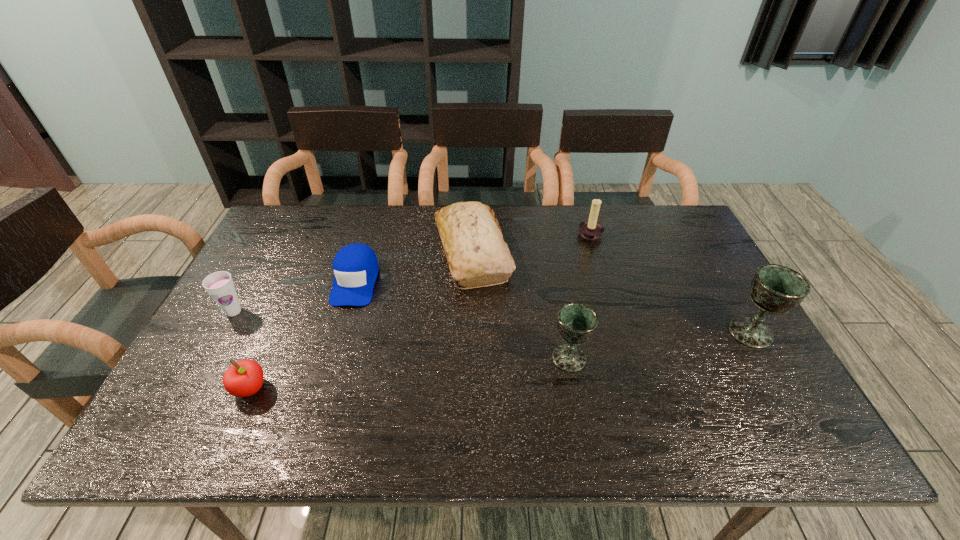
Observe the arrangement of all chalices in the image. To keep them evenly spaced, where would you place another chalice on the left? Please locate a free space. Please provide its 2D coordinates. Your answer should be formatted as a tuple, i.e. [(x, y)], where the tuple contains the x and y coordinates of a point satisfying the conditions above.

[(368, 386)]